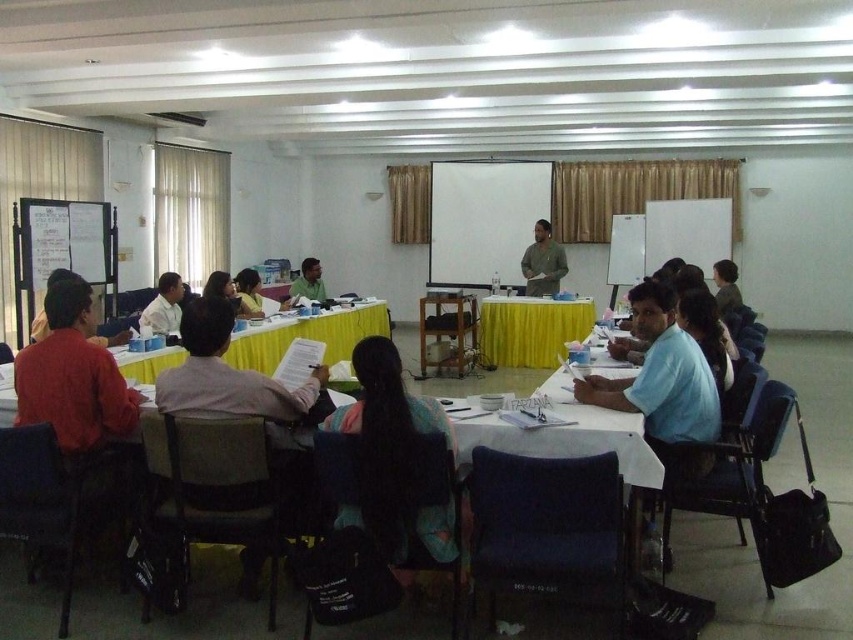
Question: Among these objects, which one is nearest to the camera?

Choices:
 (A) dark blue fabric chair at lower left
 (B) metallic silver chair at center
 (C) dark gray fabric chair at lower left

Answer: (C)

Question: Where is blue fabric chair at lower right located in relation to metallic silver chair at center in the image?

Choices:
 (A) below
 (B) above

Answer: (A)

Question: Is yellow fabric table at center behind matte green shirt at center?

Choices:
 (A) yes
 (B) no

Answer: (B)

Question: Which of the following is the farthest from the observer?

Choices:
 (A) (508, 333)
 (B) (734, 481)
 (C) (378, 488)

Answer: (A)

Question: Among these points, which one is farthest from the camera?

Choices:
 (A) (245, 304)
 (B) (714, 499)
 (C) (537, 221)
 (D) (368, 426)

Answer: (C)

Question: Can you confirm if velvet blue chair at lower center is positioned below metallic silver chair at center?

Choices:
 (A) yes
 (B) no

Answer: (A)